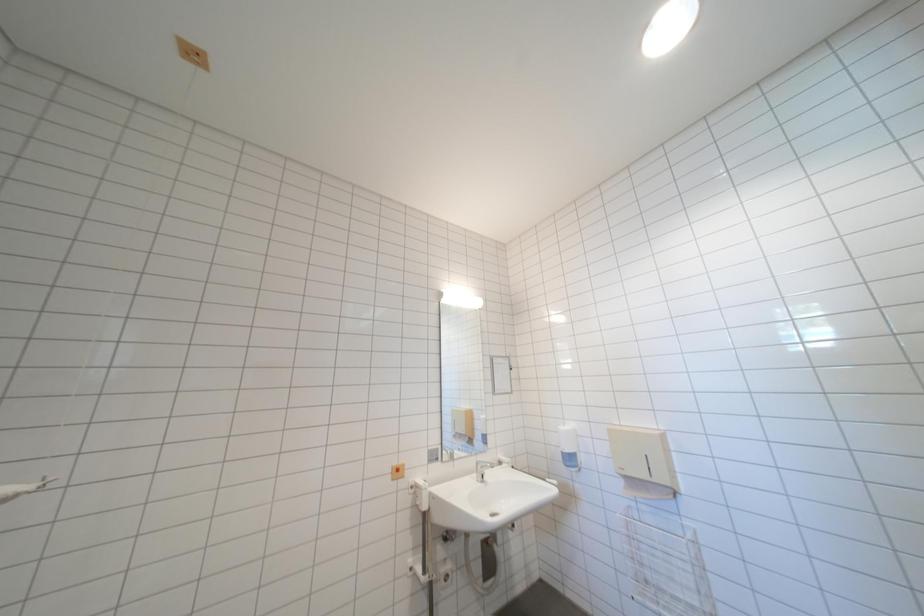
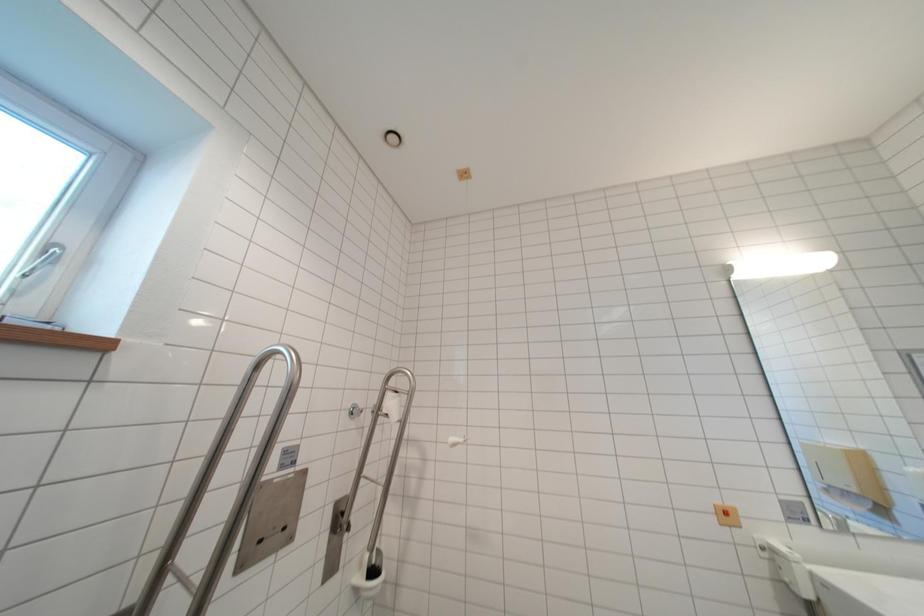
Question: Based on the continuous images, in which direction is the camera rotating? Reply with the corresponding letter.

Choices:
 (A) Left
 (B) Right
 (C) Up
 (D) Down

Answer: (A)